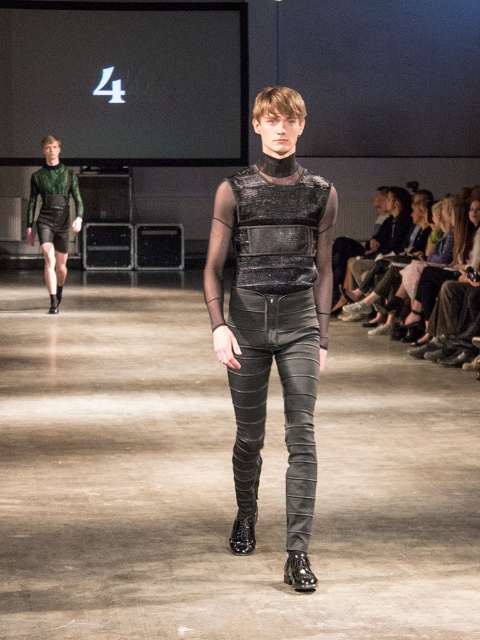
Question: Considering the real-world distances, which object is farthest from the metallic leather pants at center?

Choices:
 (A) shiny black boot at center
 (B) green matte shorts at left

Answer: (B)

Question: From the image, what is the correct spatial relationship of metallic leather pants at center in relation to shiny black boot at center?

Choices:
 (A) left
 (B) right

Answer: (A)

Question: Is metallic leather pants at center wider than glossy patent leather boot at center?

Choices:
 (A) yes
 (B) no

Answer: (A)

Question: Does shiny black boot at center appear on the right side of glossy patent leather boot at center?

Choices:
 (A) yes
 (B) no

Answer: (A)

Question: Based on their relative distances, which object is farther from the metallic leather pants at center?

Choices:
 (A) shiny black boot at center
 (B) glossy patent leather boot at center
 (C) green matte shorts at left

Answer: (C)

Question: Which point appears farthest from the camera in this image?

Choices:
 (A) (278, 360)
 (B) (303, 554)

Answer: (A)